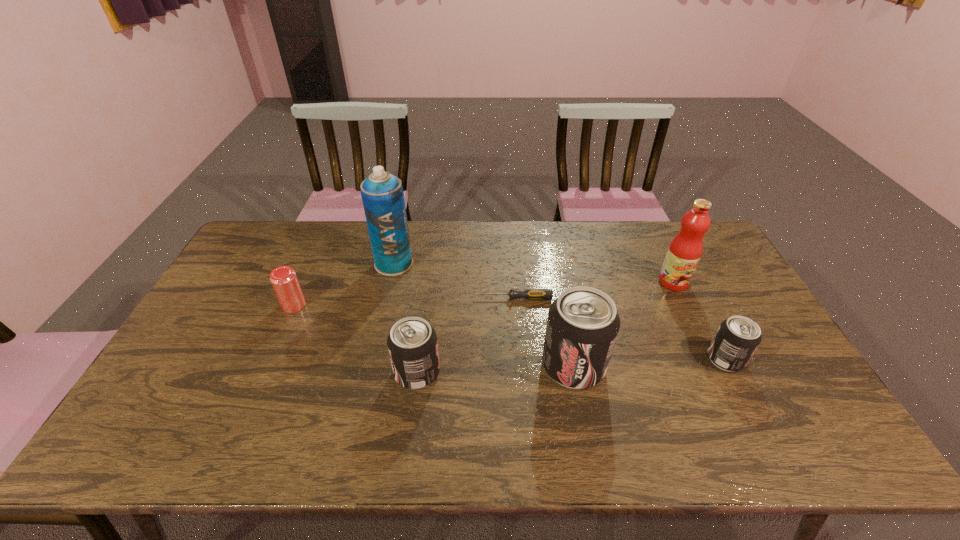
Find the location of `free space located 0.360m on the right of the second soda can from left to right`. free space located 0.360m on the right of the second soda can from left to right is located at coordinates pos(739,366).

I want to click on vacant space located 0.400m on the left of the shortest soda can, so click(561, 359).

This screenshot has width=960, height=540. Find the location of `vacant space located on the front label of the sixth shortest object`. vacant space located on the front label of the sixth shortest object is located at coordinates [x=690, y=318].

I want to click on free space located 0.400m on the front of the aerosol can, so click(369, 379).

The image size is (960, 540). Find the location of `vacant space situated 0.130m on the back of the beer can`. vacant space situated 0.130m on the back of the beer can is located at coordinates (309, 269).

You are a GUI agent. You are given a task and a screenshot of the screen. Output one action in this format:
    pyautogui.click(x=<x>, y=<y>)
    Task: Click on the vacant space situated 0.160m insert the screwdriver into a screw head
    Image resolution: width=960 pixels, height=540 pixels.
    Given the screenshot: What is the action you would take?
    [x=423, y=298]

This screenshot has width=960, height=540. What are the coordinates of `free space located 0.170m insert the screwdriver into a screw head` in the screenshot? It's located at (420, 298).

The image size is (960, 540). Find the location of `vacant space situated 0.110m insert the screwdriver into a screw head`. vacant space situated 0.110m insert the screwdriver into a screw head is located at coordinates (439, 298).

Image resolution: width=960 pixels, height=540 pixels. I want to click on object located at the far edge, so click(382, 194).

I want to click on soda can at the right edge, so 737,338.